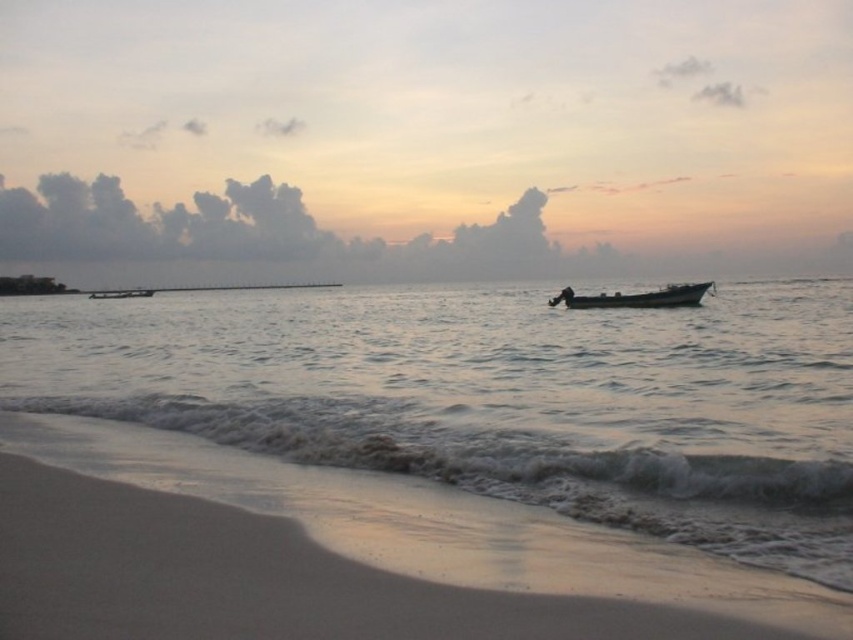
Question: Which of the following is the farthest from the observer?

Choices:
 (A) metallic silver boat at center
 (B) dark gray metallic boat at center
 (C) smooth water at center

Answer: (A)

Question: Can you confirm if smooth water at center is positioned below metallic silver boat at center?

Choices:
 (A) no
 (B) yes

Answer: (B)

Question: Which point appears farthest from the camera in this image?

Choices:
 (A) (262, 380)
 (B) (566, 288)
 (C) (148, 294)

Answer: (C)

Question: Among these points, which one is nearest to the camera?

Choices:
 (A) (137, 292)
 (B) (674, 296)
 (C) (796, 356)

Answer: (C)

Question: From the image, what is the correct spatial relationship of smooth sand at lower left in relation to metallic silver boat at center?

Choices:
 (A) left
 (B) right

Answer: (B)

Question: Can you confirm if smooth water at center is bigger than metallic silver boat at center?

Choices:
 (A) no
 (B) yes

Answer: (B)